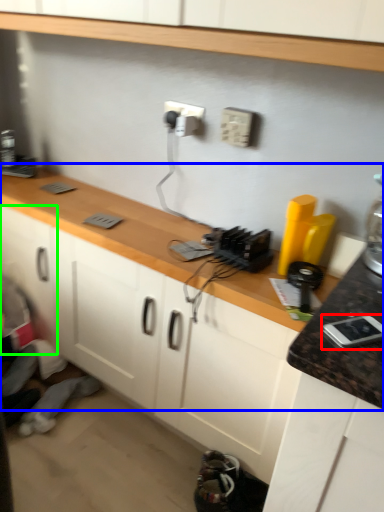
Question: Estimate the real-world distances between objects in this image. Which object is farther from appliance (highlighted by a red box), countertop (highlighted by a blue box) or cabinetry (highlighted by a green box)?

Choices:
 (A) countertop
 (B) cabinetry

Answer: (B)